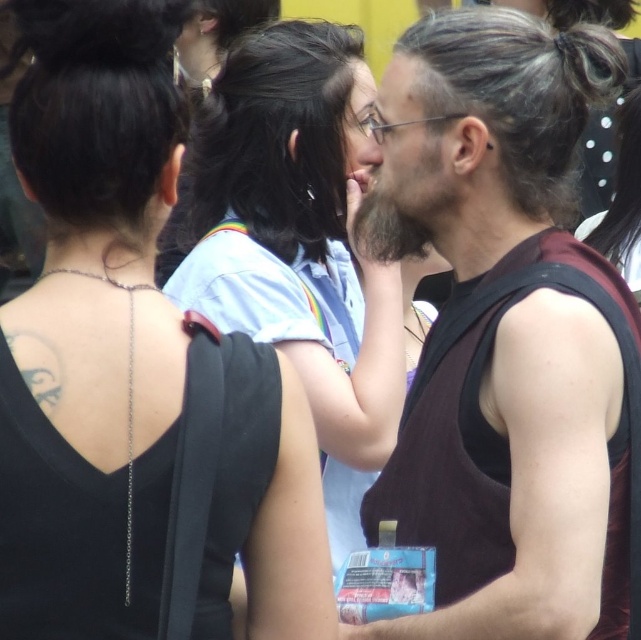
Who is higher up, matte blue shirt at center or black shiny hair bun at upper left?

Positioned higher is black shiny hair bun at upper left.

Where is `matte blue shirt at center`? The width and height of the screenshot is (641, 640). matte blue shirt at center is located at coordinates (299, 244).

The image size is (641, 640). Describe the element at coordinates (299, 244) in the screenshot. I see `matte blue shirt at center` at that location.

The image size is (641, 640). In order to click on matte blue shirt at center in this screenshot , I will do `click(299, 244)`.

Does matte blue shirt at center have a larger size compared to black shiny hair at center?

Correct, matte blue shirt at center is larger in size than black shiny hair at center.

Between matte blue shirt at center and black shiny hair at center, which one has less height?

With less height is black shiny hair at center.

Who is more distant from viewer, (281,134) or (237,182)?

Point (237,182)

Find the location of a particular element. Image resolution: width=641 pixels, height=640 pixels. matte blue shirt at center is located at coordinates (299, 244).

Is black shiny hair at center thinner than dark brown fuzzy beard at center?

No, black shiny hair at center is not thinner than dark brown fuzzy beard at center.

This screenshot has width=641, height=640. Find the location of `black shiny hair at center`. black shiny hair at center is located at coordinates (274, 140).